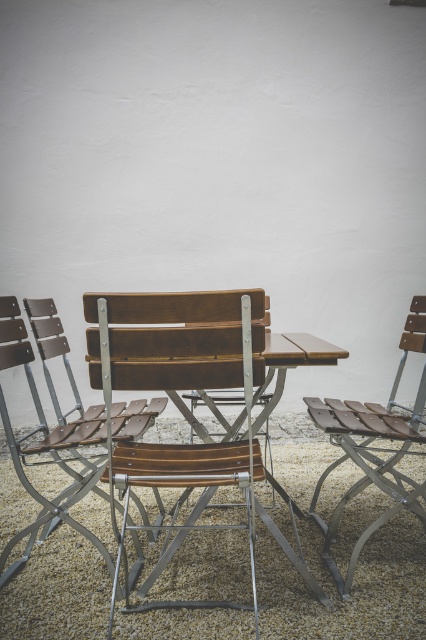
Question: Which point is farther to the camera?

Choices:
 (A) brown wood chair at right
 (B) brown leather chair at center

Answer: (A)

Question: Does wooden slats chair at center appear on the right side of brown leather chair at center?

Choices:
 (A) no
 (B) yes

Answer: (B)

Question: Among these objects, which one is farthest from the camera?

Choices:
 (A) brown leather chair at center
 (B) brown gravel at center
 (C) wooden slats chair at center

Answer: (B)

Question: Is brown gravel at center to the left of brown leather chair at center from the viewer's perspective?

Choices:
 (A) yes
 (B) no

Answer: (B)

Question: Is wooden slats chair at center behind brown leather chair at center?

Choices:
 (A) yes
 (B) no

Answer: (B)

Question: Estimate the real-world distances between objects in this image. Which object is farther from the wooden slats chair at center?

Choices:
 (A) brown leather chair at center
 (B) brown gravel at center
 (C) brown wood chair at right

Answer: (C)